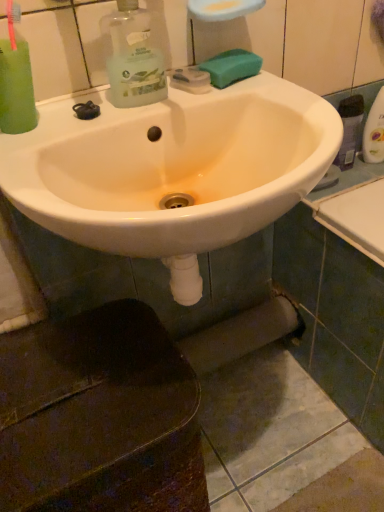
Question: Considering the relative positions of green sponge at upper right and white glossy sink at center in the image provided, is green sponge at upper right to the left or to the right of white glossy sink at center?

Choices:
 (A) left
 (B) right

Answer: (B)

Question: Is green sponge at upper right situated inside white glossy sink at center or outside?

Choices:
 (A) outside
 (B) inside

Answer: (B)

Question: From a real-world perspective, is green sponge at upper right physically located above or below white glossy sink at center?

Choices:
 (A) below
 (B) above

Answer: (B)

Question: Considering the positions of white glossy sink at center and green sponge at upper right in the image, is white glossy sink at center taller or shorter than green sponge at upper right?

Choices:
 (A) tall
 (B) short

Answer: (A)

Question: Looking at their shapes, would you say white glossy sink at center is wider or thinner than green sponge at upper right?

Choices:
 (A) wide
 (B) thin

Answer: (A)

Question: Relative to green sponge at upper right, is white glossy sink at center in front or behind?

Choices:
 (A) behind
 (B) front

Answer: (B)

Question: Do you think white glossy sink at center is within green sponge at upper right, or outside of it?

Choices:
 (A) inside
 (B) outside

Answer: (B)